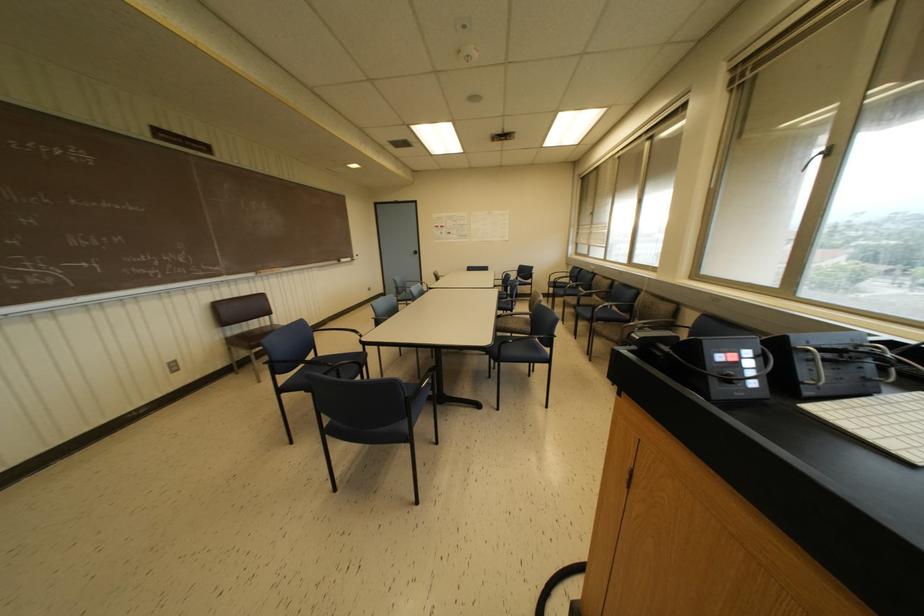
What do you see at coordinates (819, 156) in the screenshot? This screenshot has width=924, height=616. I see `the silver door handle` at bounding box center [819, 156].